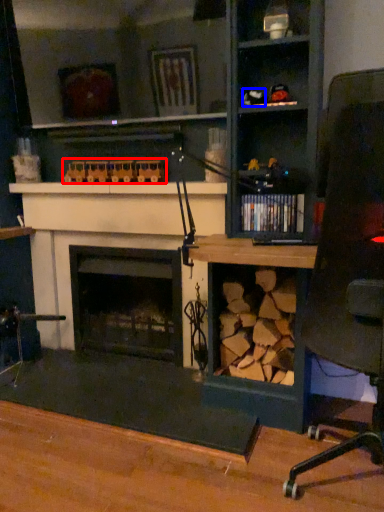
Question: Among these objects, which one is nearest to the camera, toy (highlighted by a red box) or toy (highlighted by a blue box)?

Choices:
 (A) toy
 (B) toy

Answer: (B)